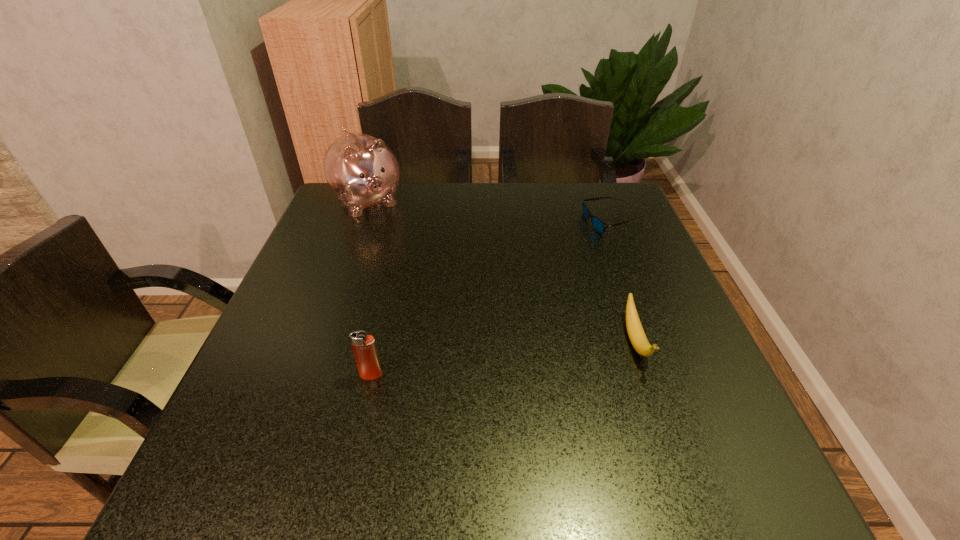
Locate an element on the screen. This screenshot has width=960, height=540. free space on the desktop that is between the third shortest object and the second shortest object and is positioned at the front of the shortest object showing the lenses is located at coordinates (477, 361).

At what (x,y) coordinates should I click in order to perform the action: click on vacant space on the desktop that is between the third shortest object and the banana and is positioned on the front facing side of the tallest object. Please return your answer as a coordinate pair (x, y). The height and width of the screenshot is (540, 960). Looking at the image, I should click on 492,360.